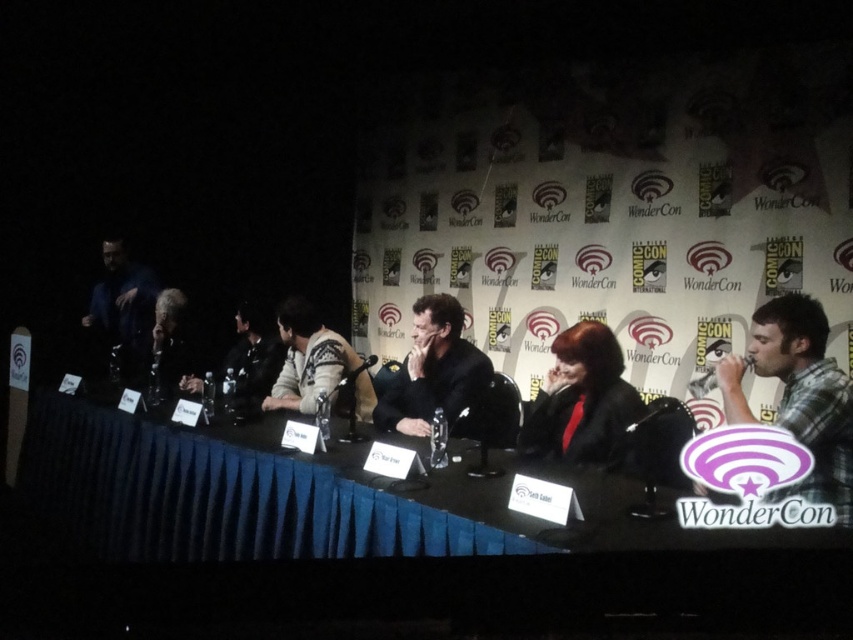
You are organizing a photo shoot for the panel discussion at WonderCon and need to ensure that the plaid shirt at right and the black leather jacket at center are both visible in the frame. Given their sizes, which clothing item requires more space in the camera frame to capture its full detail?

The black leather jacket at center requires more space in the camera frame to capture its full detail because it is larger than the plaid shirt at right.

You are an event organizer at WonderCon and need to ensure that the black leather jacket at center and the dark gray fabric at center on the stage table do not overlap. Based on their positions, which object should be moved to prevent overlap?

The black leather jacket at center might be wider than the dark gray fabric at center, so moving the dark gray fabric at center would be better to prevent overlap.

You are attending WonderCon and notice two attendees dressed in distinctive clothing. You see the plaid shirt at right and the black leather jacket at center. Which one is positioned to the right of the other?

The plaid shirt at right is positioned to the right of the black leather jacket at center.